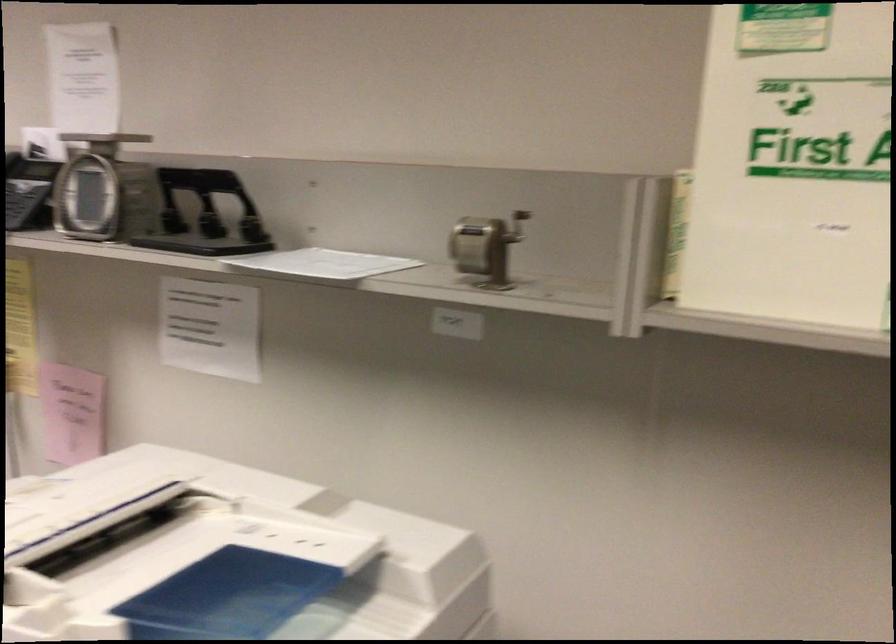
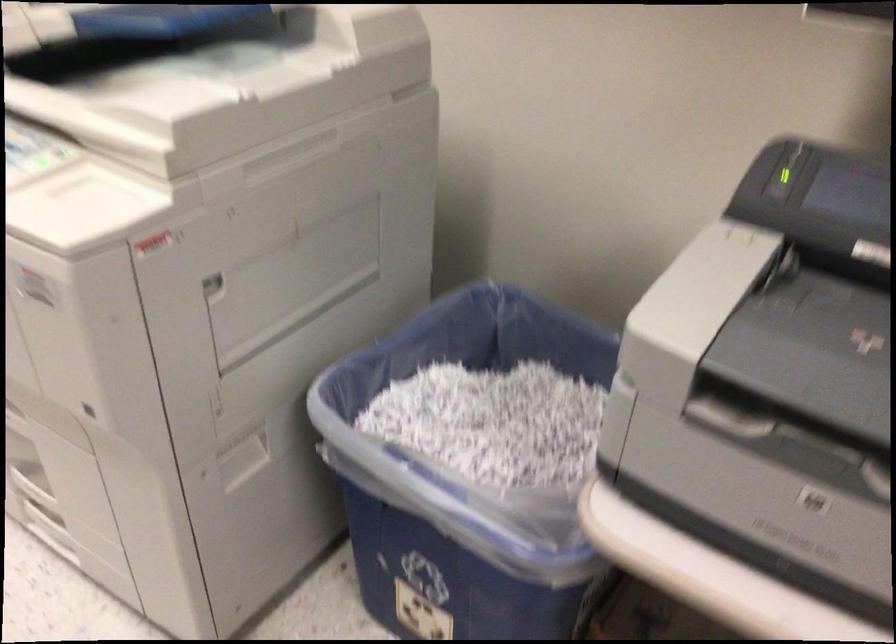
Question: The images are taken continuously from a first-person perspective. In which direction are you moving?

Choices:
 (A) Left
 (B) Right
 (C) Forward
 (D) Backward

Answer: (D)